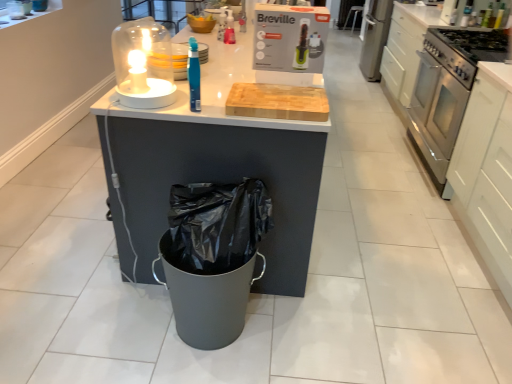
This screenshot has width=512, height=384. I want to click on stainless steel gas stove at right, so click(476, 43).

What is the approximate width of translucent blue toothbrush at center?

The width of translucent blue toothbrush at center is 2.24 inches.

Locate an element on the screen. The width and height of the screenshot is (512, 384). white matte cabinet at right is located at coordinates (487, 170).

Measure the distance between point (137,71) and camera.

Point (137,71) is 1.65 meters from camera.

Describe the element at coordinates (353, 16) in the screenshot. I see `metallic silver bar stool at center` at that location.

Locate an element on the screen. The image size is (512, 384). stainless steel gas stove at right is located at coordinates (476, 43).

Would you say stainless steel oven at right contains white matte cabinet at right?

No, white matte cabinet at right is not a part of stainless steel oven at right.

Considering the relative sizes of stainless steel oven at right and white matte cabinet at right in the image provided, is stainless steel oven at right bigger than white matte cabinet at right?

Actually, stainless steel oven at right might be smaller than white matte cabinet at right.

Is stainless steel oven at right far from white matte cabinet at right?

Actually, stainless steel oven at right and white matte cabinet at right are a little close together.

From the image's perspective, which one is positioned lower, stainless steel oven at right or white matte cabinet at right?

white matte cabinet at right, from the image's perspective.

Is white matte cabinet at right inside the boundaries of green plastic hairdryer at upper center, or outside?

white matte cabinet at right is spatially situated outside green plastic hairdryer at upper center.

Is white matte cabinet at right bigger than green plastic hairdryer at upper center?

Correct, white matte cabinet at right is larger in size than green plastic hairdryer at upper center.

Does white matte cabinet at right turn towards green plastic hairdryer at upper center?

Yes, white matte cabinet at right is facing green plastic hairdryer at upper center.

Between white matte cabinet at right and green plastic hairdryer at upper center, which one appears on the left side from the viewer's perspective?

From the viewer's perspective, green plastic hairdryer at upper center appears more on the left side.

Is translucent glass candle at upper left behind stainless steel gas stove at right?

No, translucent glass candle at upper left is closer to the camera.

Is stainless steel gas stove at right at the back of translucent glass candle at upper left?

No, stainless steel gas stove at right is not at the back of translucent glass candle at upper left.

Can you see translucent glass candle at upper left touching stainless steel gas stove at right?

No.

This screenshot has width=512, height=384. In order to click on gas stove that appears below the translucent glass candle at upper left (from a real-world perspective) in this screenshot , I will do `click(476, 43)`.

Considering the sizes of stainless steel oven at right and green plastic hairdryer at upper center in the image, is stainless steel oven at right bigger or smaller than green plastic hairdryer at upper center?

In the image, stainless steel oven at right appears to be larger than green plastic hairdryer at upper center.

Is stainless steel oven at right located outside green plastic hairdryer at upper center?

Yes, stainless steel oven at right is located beyond the bounds of green plastic hairdryer at upper center.

Is green plastic hairdryer at upper center at the back of stainless steel oven at right?

No, stainless steel oven at right is not facing the opposite direction of green plastic hairdryer at upper center.

Consider the image. Is stainless steel oven at right positioned behind green plastic hairdryer at upper center?

Yes, stainless steel oven at right is further from the camera.

Is metallic silver bar stool at center inside the boundaries of stainless steel gas stove at right, or outside?

metallic silver bar stool at center is located beyond the bounds of stainless steel gas stove at right.

From a real-world perspective, who is located lower, metallic silver bar stool at center or stainless steel gas stove at right?

In real-world perspective, metallic silver bar stool at center is lower.

Does metallic silver bar stool at center have a lesser height compared to stainless steel gas stove at right?

No.

Is metallic silver bar stool at center far from stainless steel gas stove at right?

Indeed, metallic silver bar stool at center is not near stainless steel gas stove at right.

Considering the positions of point (353, 10) and point (158, 62), is point (353, 10) closer or farther from the camera than point (158, 62)?

Point (353, 10) appears to be farther away from the viewer than point (158, 62).

Consider the image. Does metallic silver bar stool at center have a lesser height compared to translucent glass candle at upper left?

No.

Does metallic silver bar stool at center come behind translucent glass candle at upper left?

Yes, it is behind translucent glass candle at upper left.

You are a GUI agent. You are given a task and a screenshot of the screen. Output one action in this format:
    pyautogui.click(x=<x>, y=<y>)
    Task: Click on the bar stool above the translucent glass candle at upper left (from the image's perspective)
    The height and width of the screenshot is (384, 512).
    Given the screenshot: What is the action you would take?
    pyautogui.click(x=353, y=16)

Is stainless steel oven at right to the right of translucent blue toothbrush at center from the viewer's perspective?

Correct, you'll find stainless steel oven at right to the right of translucent blue toothbrush at center.

Between stainless steel oven at right and translucent blue toothbrush at center, which one has more height?

Standing taller between the two is stainless steel oven at right.

From the image's perspective, is stainless steel oven at right on translucent blue toothbrush at center?

Yes, from the image's perspective, stainless steel oven at right is on top of translucent blue toothbrush at center.

Is stainless steel oven at right surrounding translucent blue toothbrush at center?

No, translucent blue toothbrush at center is located outside of stainless steel oven at right.

Locate an element on the screen. The width and height of the screenshot is (512, 384). home appliance above the white matte cabinet at right (from the image's perspective) is located at coordinates (447, 90).

Where is `kitchen appliance that is above the white matte cabinet at right (from a real-world perspective)`? This screenshot has width=512, height=384. kitchen appliance that is above the white matte cabinet at right (from a real-world perspective) is located at coordinates (290, 38).

In the scene shown: When comparing their distances from translucent blue toothbrush at center, does metallic silver bar stool at center or stainless steel gas stove at right seem further?

Among the two, metallic silver bar stool at center is located further to translucent blue toothbrush at center.

Which object lies further to the anchor point white matte cabinet at right, stainless steel oven at right or translucent blue toothbrush at center?

Based on the image, translucent blue toothbrush at center appears to be further to white matte cabinet at right.

When comparing their distances from green plastic hairdryer at upper center, does metallic silver bar stool at center or white matte cabinet at right seem further?

The object further to green plastic hairdryer at upper center is metallic silver bar stool at center.

Based on their spatial positions, is translucent glass candle at upper left or stainless steel oven at right closer to translucent blue toothbrush at center?

translucent glass candle at upper left.

Looking at the image, which one is located closer to translucent glass candle at upper left, white matte cabinet at right or stainless steel gas stove at right?

Based on the image, white matte cabinet at right appears to be nearer to translucent glass candle at upper left.

From the image, which object appears to be nearer to translucent blue toothbrush at center, metallic silver bar stool at center or stainless steel oven at right?

stainless steel oven at right is positioned closer to the anchor translucent blue toothbrush at center.

Considering their positions, is stainless steel oven at right positioned further to metallic silver bar stool at center than translucent blue toothbrush at center?

translucent blue toothbrush at center lies further to metallic silver bar stool at center than the other object.

Based on their spatial positions, is white matte cabinet at right or stainless steel oven at right closer to stainless steel gas stove at right?

stainless steel oven at right lies closer to stainless steel gas stove at right than the other object.

Where is `gas stove between green plastic hairdryer at upper center and metallic silver bar stool at center along the z-axis`? gas stove between green plastic hairdryer at upper center and metallic silver bar stool at center along the z-axis is located at coordinates (476, 43).

I want to click on cabinetry between translucent glass candle at upper left and stainless steel gas stove at right in the horizontal direction, so click(487, 170).

Identify the location of gas stove located between white matte cabinet at right and metallic silver bar stool at center in the depth direction. This screenshot has height=384, width=512. (476, 43).

Where is `home appliance between translucent blue toothbrush at center and stainless steel gas stove at right in the horizontal direction`? This screenshot has width=512, height=384. home appliance between translucent blue toothbrush at center and stainless steel gas stove at right in the horizontal direction is located at coordinates (447, 90).